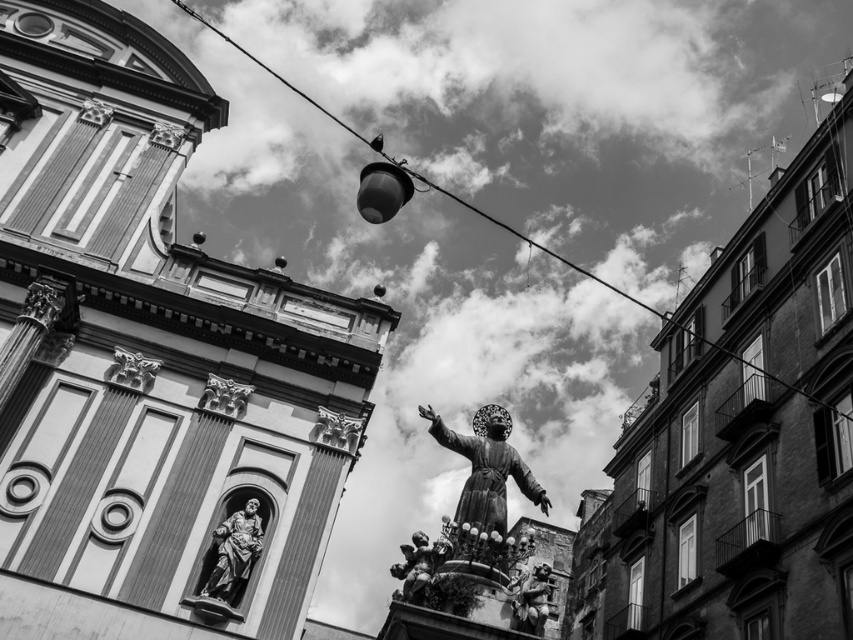
Based on the photo, in the black and white photograph of the European city scene, there is a polished marble statue at center and a polished stone relief at upper center. From the perspective of someone standing in front of the image, which object is positioned to the left of the other?

The polished marble statue at center is to the left of the polished stone relief at upper center.

You are an art historian examining this black and white photograph. You notice the polished marble statue at center and the polished stone relief at upper center. Based on their positions, which object is placed higher in the image?

The polished marble statue at center is located above the polished stone relief at upper center, meaning it is placed higher in the image.